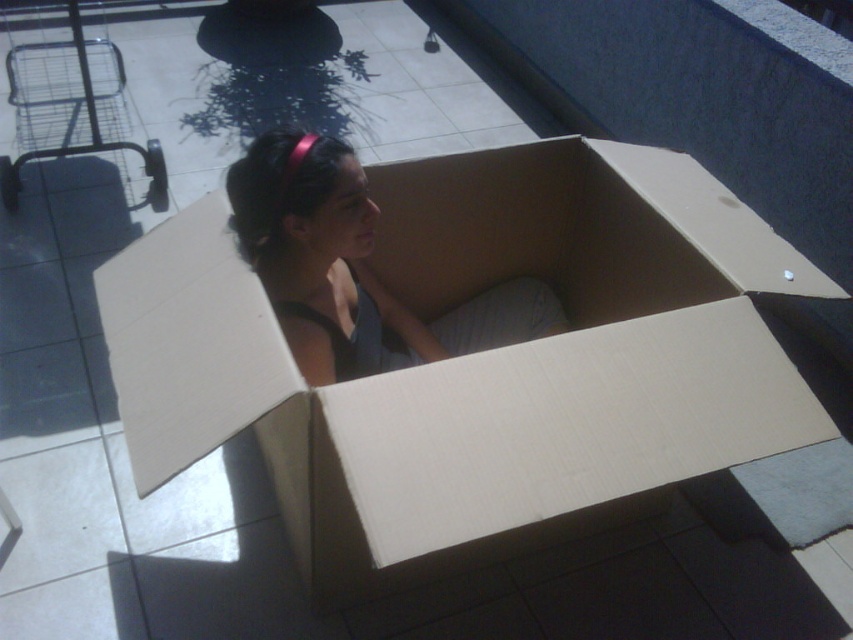
You are a delivery person who needs to place a package inside the cardboard box at center where the matte cardboard girl at center is sitting. Can you put the package in the box without disturbing the girl?

The cardboard box at center is closer to the viewer than the matte cardboard girl at center, so the girl is actually sitting inside the box. Therefore, you cannot place the package inside the box without disturbing her.